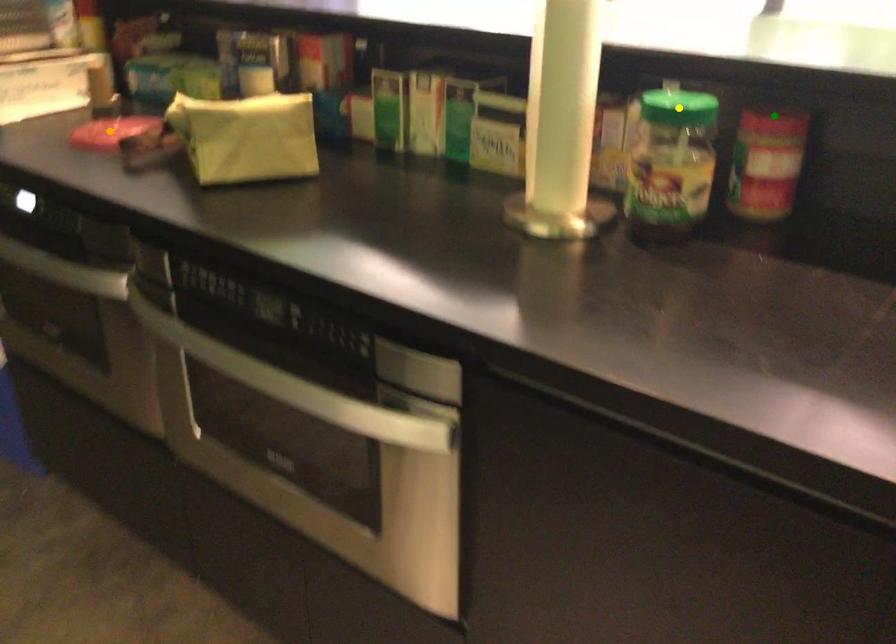
Order these from nearest to farthest:
1. green point
2. yellow point
3. orange point

1. yellow point
2. green point
3. orange point